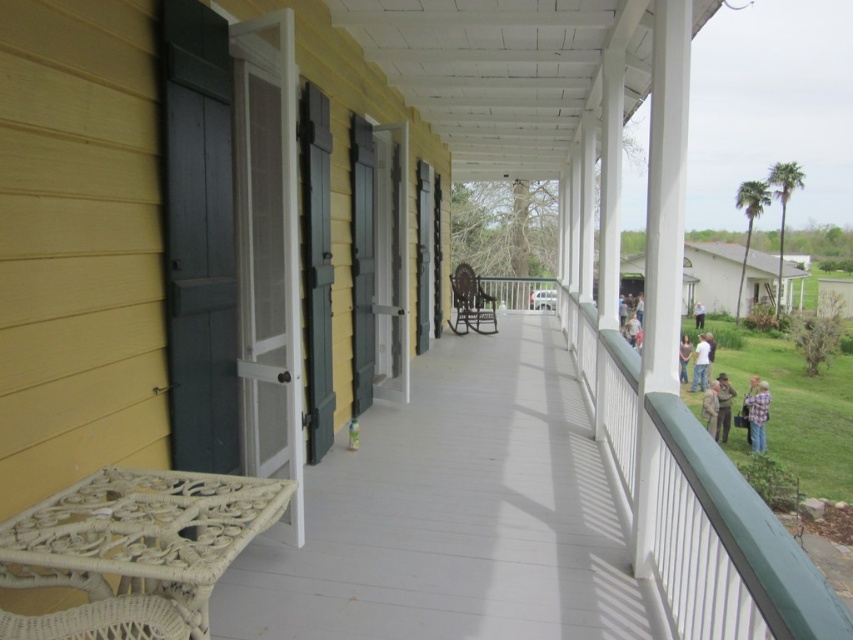
You are a delivery person with a package that is 1.2 meters wide. You need to place it between the blue plaid shirt at lower right and the light brown leather jacket at lower right on the porch. Will there be enough space?

The distance between the blue plaid shirt at lower right and the light brown leather jacket at lower right is 1.04 meters. Since the package is 1.2 meters wide, it will not fit in the available space.

You are standing on the porch and want to pick up the blue plaid shirt at lower right. Where should you look to find it?

The blue plaid shirt at lower right is located at point (757, 413), so you should look there to find it.